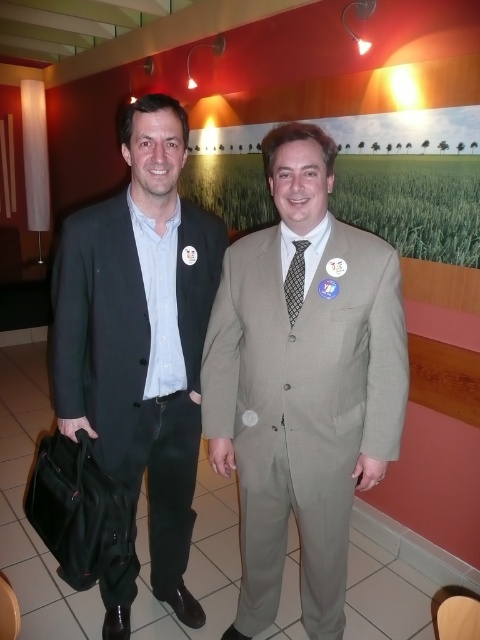
Question: Can you confirm if light beige suit at center is thinner than matte black suit at left?

Choices:
 (A) no
 (B) yes

Answer: (A)

Question: Estimate the real-world distances between objects in this image. Which object is farther from the black textured tie at center?

Choices:
 (A) light beige suit at center
 (B) matte black suit at left

Answer: (B)

Question: Considering the real-world distances, which object is farthest from the light beige suit at center?

Choices:
 (A) black textured tie at center
 (B) matte black suit at left

Answer: (A)

Question: Estimate the real-world distances between objects in this image. Which object is farther from the matte black suit at left?

Choices:
 (A) black textured tie at center
 (B) light beige suit at center

Answer: (A)

Question: Can you confirm if light beige suit at center is wider than matte black suit at left?

Choices:
 (A) no
 (B) yes

Answer: (B)

Question: Is light beige suit at center further to the viewer compared to matte black suit at left?

Choices:
 (A) yes
 (B) no

Answer: (B)